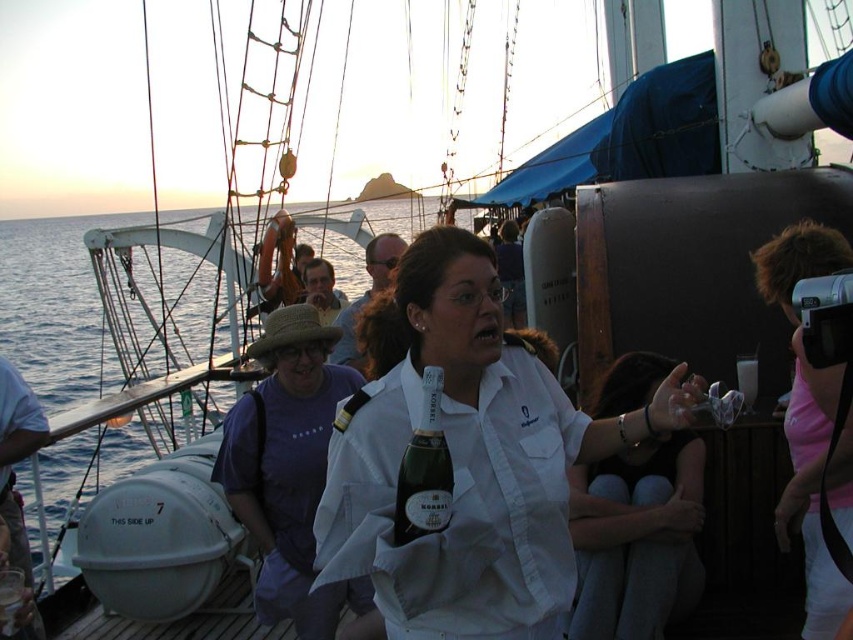
Who is taller, purple cotton shirt at center or pink fabric camera at right?

With more height is pink fabric camera at right.

Does purple cotton shirt at center have a greater width compared to pink fabric camera at right?

Yes.

Is point (308, 577) closer to camera compared to point (840, 236)?

Yes, point (308, 577) is closer to viewer.

The height and width of the screenshot is (640, 853). I want to click on purple cotton shirt at center, so click(288, 468).

Is white matte shirt at center above pink fabric camera at right?

No, white matte shirt at center is not above pink fabric camera at right.

Is point (611, 604) farther from camera compared to point (799, 355)?

No.

Locate an element on the screen. This screenshot has height=640, width=853. white matte shirt at center is located at coordinates (636, 538).

Is point (512, 592) in front of point (297, 406)?

Yes, it is in front of point (297, 406).

Can you confirm if white shirt at center is positioned below purple cotton shirt at center?

Actually, white shirt at center is above purple cotton shirt at center.

Does point (554, 497) lie behind point (252, 449)?

No, it is in front of (252, 449).

I want to click on white shirt at center, so click(x=469, y=460).